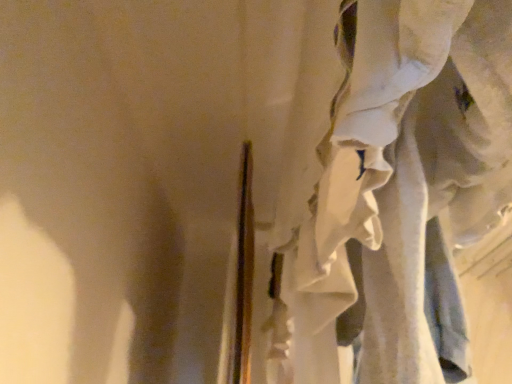
This screenshot has height=384, width=512. Describe the element at coordinates (401, 169) in the screenshot. I see `white cotton laundry at right` at that location.

You are a GUI agent. You are given a task and a screenshot of the screen. Output one action in this format:
    pyautogui.click(x=<x>, y=<y>)
    Task: Click on the white cotton laundry at right
    This screenshot has height=384, width=512.
    Given the screenshot: What is the action you would take?
    pyautogui.click(x=401, y=169)

You are a GUI agent. You are given a task and a screenshot of the screen. Output one action in this format:
    pyautogui.click(x=<x>, y=<y>)
    Task: Click on the white cotton laundry at right
    This screenshot has height=384, width=512.
    Given the screenshot: What is the action you would take?
    pyautogui.click(x=401, y=169)